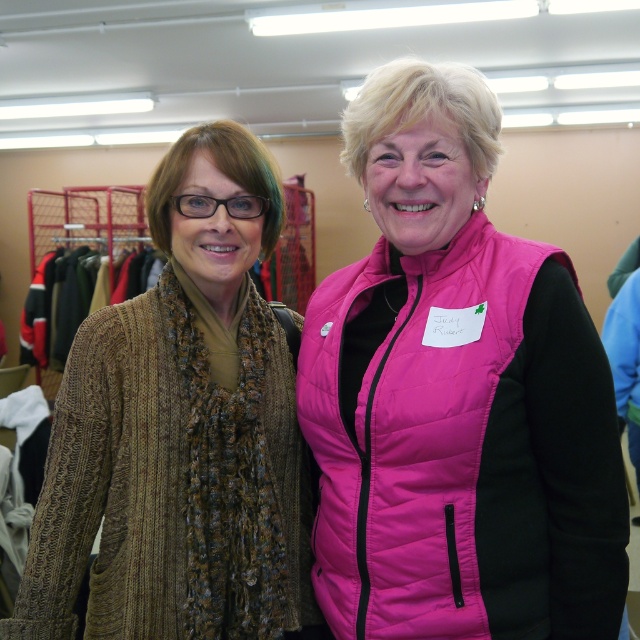
Can you confirm if pink quilted vest at center is positioned below knitted brown scarf at left?

No.

Locate an element on the screen. pink quilted vest at center is located at coordinates (456, 396).

Describe the element at coordinates (456, 396) in the screenshot. I see `pink quilted vest at center` at that location.

Where is `pink quilted vest at center`? pink quilted vest at center is located at coordinates (456, 396).